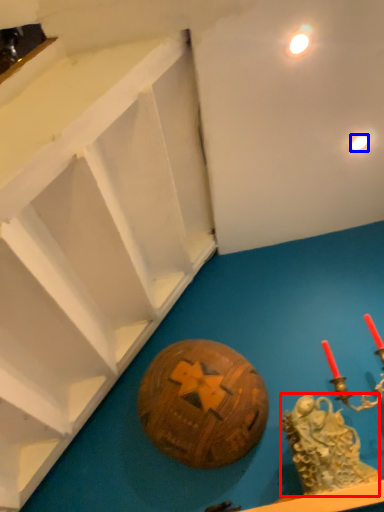
Question: Which object is closer to the camera taking this photo, type (highlighted by a red box) or light (highlighted by a blue box)?

Choices:
 (A) type
 (B) light

Answer: (A)